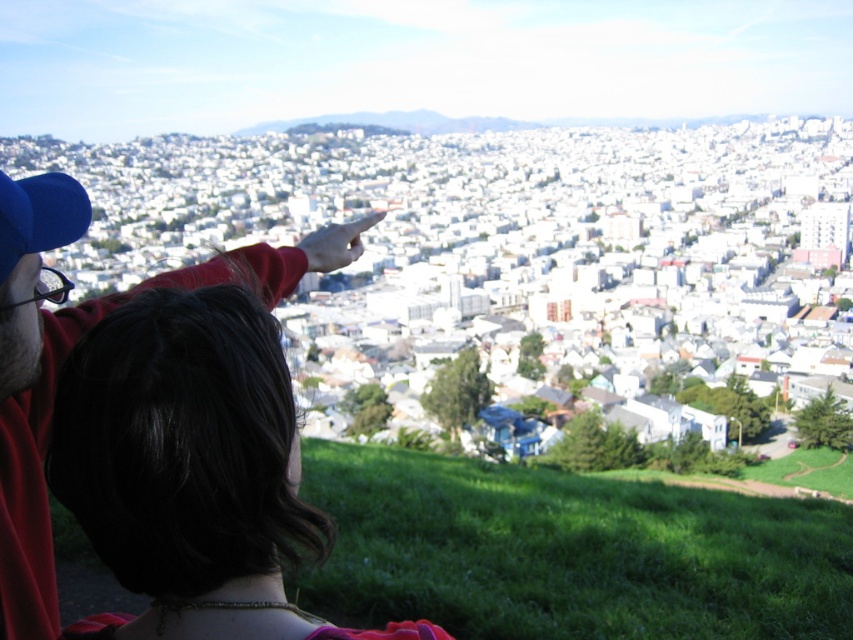
Question: Is blue fabric cap at upper left in front of blue fabric baseball cap at upper left?

Choices:
 (A) no
 (B) yes

Answer: (B)

Question: Which of the following is the closest to the observer?

Choices:
 (A) (0, 224)
 (B) (33, 305)

Answer: (A)

Question: Observing the image, what is the correct spatial positioning of blue fabric cap at upper left in reference to blue fabric baseball cap at upper left?

Choices:
 (A) right
 (B) left

Answer: (A)

Question: Is blue fabric cap at upper left wider than blue fabric baseball cap at upper left?

Choices:
 (A) no
 (B) yes

Answer: (B)